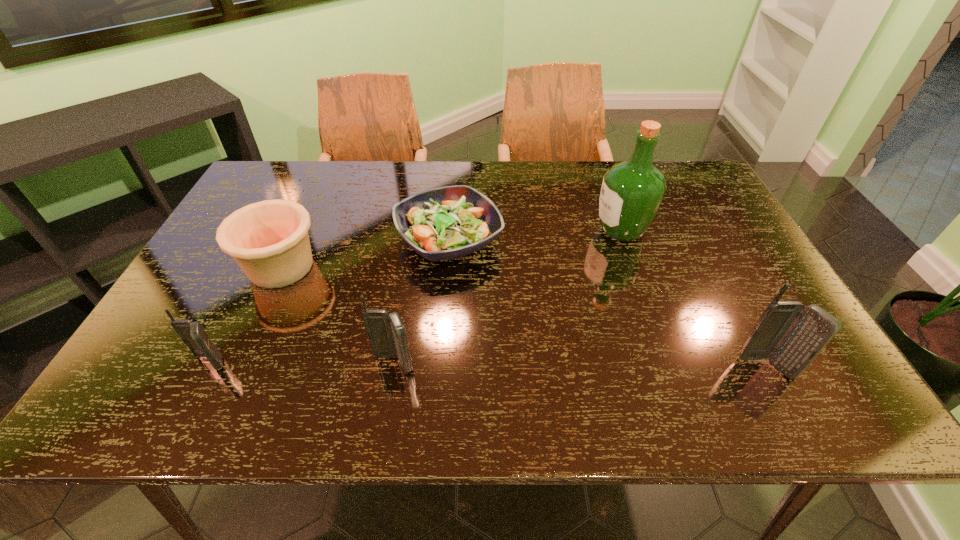
You are a GUI agent. You are given a task and a screenshot of the screen. Output one action in this format:
    pyautogui.click(x=<x>, y=<y>)
    Task: Click on the vacant area situated 0.100m on the front-facing side of the liquor
    
    Given the screenshot: What is the action you would take?
    pyautogui.click(x=559, y=230)

I want to click on vacant space situated 0.400m on the front-facing side of the liquor, so click(x=453, y=230).

Locate an element on the screen. vacant region located 0.160m on the front-facing side of the liquor is located at coordinates (538, 230).

Find the location of a particular element. This screenshot has height=540, width=960. vacant space located 0.130m on the right of the pottery is located at coordinates (372, 267).

What are the coordinates of `cellular telephone that is at the left edge` in the screenshot? It's located at (193, 334).

Find the location of a particular element. The width and height of the screenshot is (960, 540). pottery that is at the left edge is located at coordinates (269, 240).

Identify the location of object situated at the right edge. The width and height of the screenshot is (960, 540). (791, 335).

In order to click on object situated at the near left corner in this screenshot , I will do `click(193, 334)`.

Where is `object that is positioned at the near right corner`? The width and height of the screenshot is (960, 540). object that is positioned at the near right corner is located at coordinates (791, 335).

This screenshot has height=540, width=960. What are the coordinates of `vacant space at the far edge` in the screenshot? It's located at (348, 184).